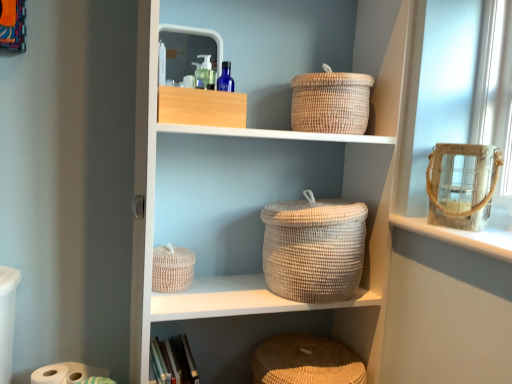
Question: Considering the positions of point (210, 339) and point (334, 119), is point (210, 339) closer or farther from the camera than point (334, 119)?

Choices:
 (A) farther
 (B) closer

Answer: (A)

Question: From a real-world perspective, is natural woven baskets at center above or below natural woven basket at upper center, the 1th basket viewed from the top?

Choices:
 (A) below
 (B) above

Answer: (A)

Question: Which of these objects is positioned farthest from the orange fabric picture frame at upper left?

Choices:
 (A) white matte toilet paper at lower left
 (B) natural woven basket at center, the second basket when ordered from bottom to top
 (C) natural woven basket at lower center, which appears as the 3th basket when viewed from the top
 (D) white woven basket at center
 (E) natural woven basket at upper center, the 3th basket in the bottom-to-top sequence

Answer: (C)

Question: Which object is positioned farthest from the natural woven basket at lower center, the 1th basket in the bottom-to-top sequence?

Choices:
 (A) natural woven basket at center, the second basket when ordered from bottom to top
 (B) white matte toilet paper at lower left
 (C) orange fabric picture frame at upper left
 (D) natural woven basket at upper center, the 3th basket in the bottom-to-top sequence
 (E) natural woven baskets at center

Answer: (C)